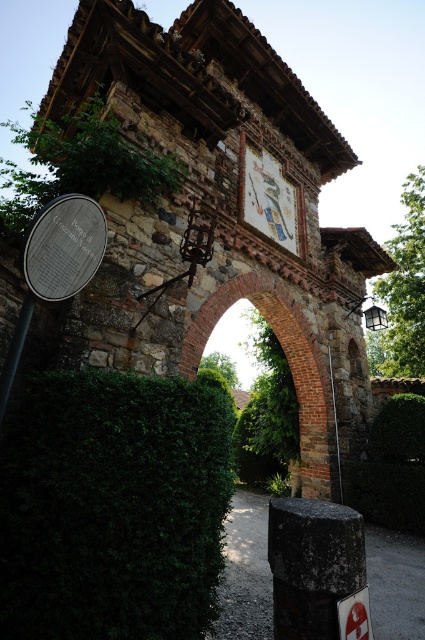
Is point (14, 348) farther from viewer compared to point (337, 465)?

No.

Does black matte pole at lower left have a greater height compared to smooth stone post at center?

No.

Which is behind, point (10, 344) or point (331, 374)?

Point (331, 374)

Where is `black matte pole at lower left`? The image size is (425, 640). black matte pole at lower left is located at coordinates (14, 349).

Which is above, green leafy hedge at center or white plastic sign at lower right?

green leafy hedge at center

Based on the photo, who is more forward, (127, 435) or (345, 602)?

Point (345, 602)

This screenshot has height=640, width=425. Identify the location of green leafy hedge at center. (113, 508).

Can you confirm if metallic circular sign at left is thinner than black matte pole at lower left?

In fact, metallic circular sign at left might be wider than black matte pole at lower left.

Who is more distant from viewer, (84, 248) or (10, 348)?

Positioned behind is point (84, 248).

Measure the distance between metallic circular sign at left and camera.

metallic circular sign at left is 2.77 meters from camera.

Where is `metallic circular sign at left`? The width and height of the screenshot is (425, 640). metallic circular sign at left is located at coordinates (56, 262).